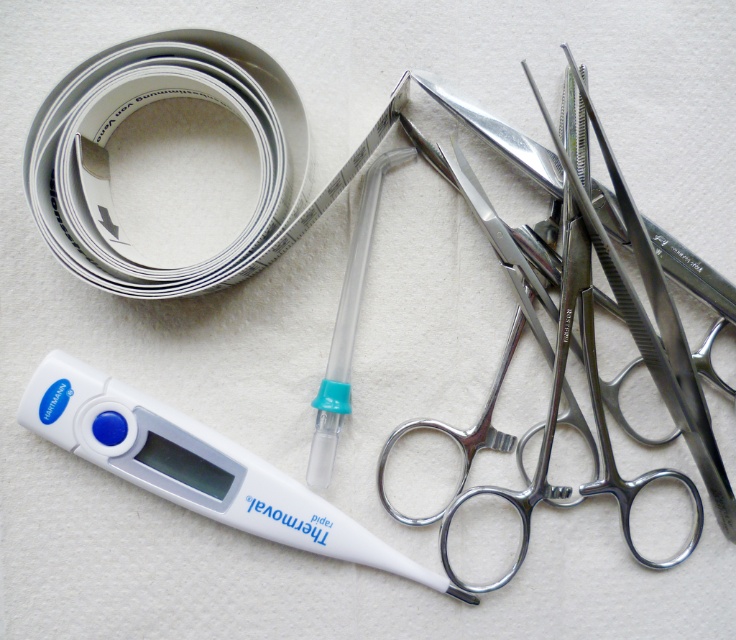
Find the location of `white paper tape at upper left`. white paper tape at upper left is located at coordinates (132, 113).

Who is lower down, white paper tape at upper left or white plastic thermometer at lower left?

white plastic thermometer at lower left is lower down.

Is point (95, 196) positioned in front of point (318, 548)?

Yes, point (95, 196) is in front of point (318, 548).

Locate an element on the screen. Image resolution: width=736 pixels, height=640 pixels. white paper tape at upper left is located at coordinates (132, 113).